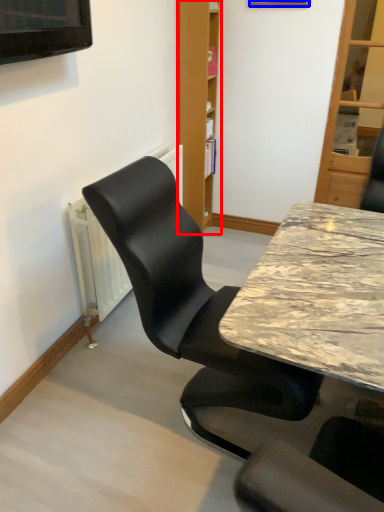
Question: Which object is further to the camera taking this photo, bookshelf (highlighted by a red box) or picture frame (highlighted by a blue box)?

Choices:
 (A) bookshelf
 (B) picture frame

Answer: (A)